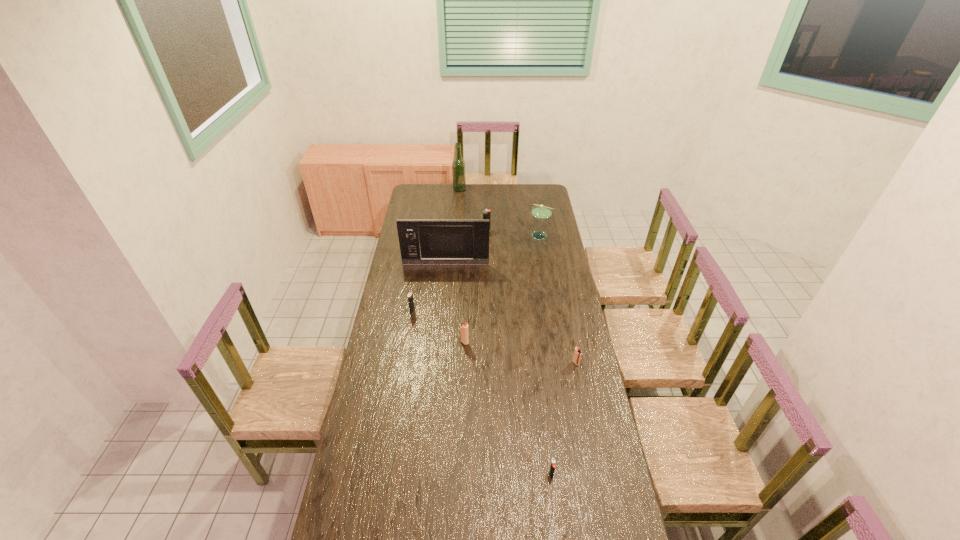
Locate an element on the screen. The image size is (960, 540). vacant region located 0.250m on the right of the leftmost black igniter is located at coordinates (467, 312).

I want to click on vacant area located 0.220m on the right of the fourth igniter from right to left, so click(518, 342).

The image size is (960, 540). In order to click on free location located 0.280m on the left of the right red igniter in this screenshot , I will do `click(507, 363)`.

Identify the location of vacant space positioned on the back of the nearest object. click(x=540, y=385).

You are a GUI agent. You are given a task and a screenshot of the screen. Output one action in this format:
    pyautogui.click(x=<x>, y=<y>)
    Task: Click on the object positioned at the far edge
    
    Given the screenshot: What is the action you would take?
    pyautogui.click(x=458, y=164)

I want to click on microwave oven located at the left edge, so click(422, 241).

Locate an element on the screen. igniter located in the left edge section of the desktop is located at coordinates (410, 295).

Image resolution: width=960 pixels, height=540 pixels. Find the location of `martini that is at the right edge`. martini that is at the right edge is located at coordinates (540, 211).

You are a GUI agent. You are given a task and a screenshot of the screen. Output one action in this format:
    pyautogui.click(x=<x>, y=<y>)
    Task: Click on the igniter present at the right edge
    Image resolution: width=960 pixels, height=540 pixels.
    Given the screenshot: What is the action you would take?
    pyautogui.click(x=577, y=353)

In the image, there is a desktop. At what (x,y) coordinates should I click in order to perform the action: click on blank space at the far edge. Please return your answer as a coordinate pair (x, y). This screenshot has height=540, width=960. Looking at the image, I should click on (459, 201).